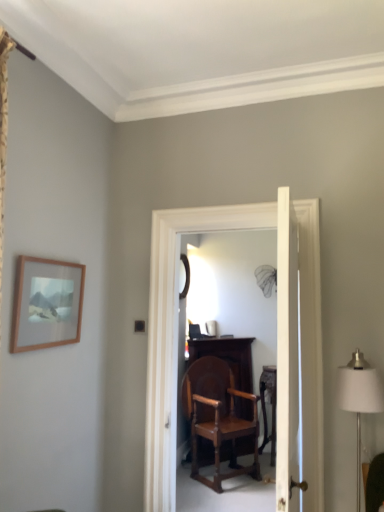
Question: Is white smooth door at center smaller than wooden table at center?

Choices:
 (A) no
 (B) yes

Answer: (A)

Question: Considering the relative sizes of white smooth door at center and wooden table at center in the image provided, is white smooth door at center taller than wooden table at center?

Choices:
 (A) yes
 (B) no

Answer: (A)

Question: Does white smooth door at center have a greater width compared to wooden table at center?

Choices:
 (A) no
 (B) yes

Answer: (A)

Question: Does white smooth door at center appear on the left side of wooden table at center?

Choices:
 (A) no
 (B) yes

Answer: (B)

Question: From a real-world perspective, is white smooth door at center located beneath wooden table at center?

Choices:
 (A) no
 (B) yes

Answer: (A)

Question: Looking at their shapes, would you say white smooth door at center is wider or thinner than black glass mirror at center?

Choices:
 (A) thin
 (B) wide

Answer: (B)

Question: Is white smooth door at center to the left or to the right of black glass mirror at center in the image?

Choices:
 (A) right
 (B) left

Answer: (A)

Question: Considering their positions, is white smooth door at center located in front of or behind black glass mirror at center?

Choices:
 (A) behind
 (B) front

Answer: (B)

Question: From a real-world perspective, is white smooth door at center physically located above or below black glass mirror at center?

Choices:
 (A) above
 (B) below

Answer: (B)

Question: In terms of height, does wooden table at center look taller or shorter compared to white fabric lampshade at right?

Choices:
 (A) tall
 (B) short

Answer: (A)

Question: In terms of size, does wooden table at center appear bigger or smaller than white fabric lampshade at right?

Choices:
 (A) small
 (B) big

Answer: (B)

Question: Is point (264, 369) positioned closer to the camera than point (355, 352)?

Choices:
 (A) closer
 (B) farther

Answer: (B)

Question: Visually, is wooden table at center positioned to the left or to the right of white fabric lampshade at right?

Choices:
 (A) right
 (B) left

Answer: (A)

Question: Would you say black glass mirror at center is to the left or to the right of white smooth door at center in the picture?

Choices:
 (A) right
 (B) left

Answer: (B)

Question: In terms of height, does black glass mirror at center look taller or shorter compared to white smooth door at center?

Choices:
 (A) tall
 (B) short

Answer: (B)